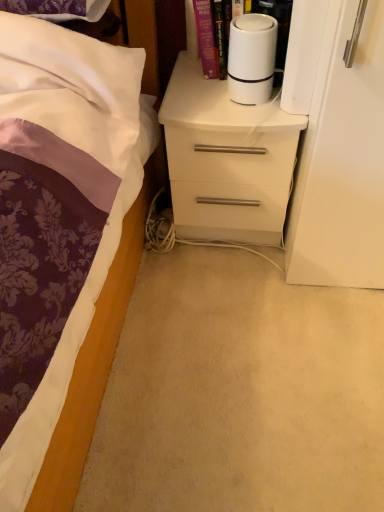
This screenshot has width=384, height=512. Identify the location of white glossy chest of drawers at center. (226, 159).

Describe the element at coordinates (251, 58) in the screenshot. I see `white matte cylindrical object at upper center` at that location.

Find the location of a particular element. white glossy chest of drawers at center is located at coordinates (226, 159).

Is white matte cylindrical object at upper center inside or outside of white matte cylindrical device at upper right?

white matte cylindrical object at upper center is spatially situated outside white matte cylindrical device at upper right.

Considering the relative sizes of white matte cylindrical object at upper center and white matte cylindrical device at upper right in the image provided, is white matte cylindrical object at upper center smaller than white matte cylindrical device at upper right?

Yes, white matte cylindrical object at upper center is smaller than white matte cylindrical device at upper right.

Considering the sizes of objects white matte cylindrical object at upper center and white matte cylindrical device at upper right in the image provided, who is taller, white matte cylindrical object at upper center or white matte cylindrical device at upper right?

With more height is white matte cylindrical device at upper right.

In the scene shown: From the image's perspective, is white matte cylindrical object at upper center over white matte cylindrical device at upper right?

No, from the image's perspective, white matte cylindrical object at upper center is not above white matte cylindrical device at upper right.

Find the location of `the chest of drawers behind the white matte cylindrical object at upper center`. the chest of drawers behind the white matte cylindrical object at upper center is located at coordinates (226, 159).

Is white matte cylindrical object at upper center at the left side of white glossy chest of drawers at center?

Incorrect, white matte cylindrical object at upper center is not on the left side of white glossy chest of drawers at center.

Is white matte cylindrical object at upper center facing away from white glossy chest of drawers at center?

white matte cylindrical object at upper center is not turned away from white glossy chest of drawers at center.

Can you confirm if white matte cylindrical object at upper center is wider than white glossy chest of drawers at center?

In fact, white matte cylindrical object at upper center might be narrower than white glossy chest of drawers at center.

In the image, is white matte cylindrical device at upper right positioned in front of or behind white glossy chest of drawers at center?

Visually, white matte cylindrical device at upper right is located in front of white glossy chest of drawers at center.

From a real-world perspective, which is physically below, white matte cylindrical device at upper right or white glossy chest of drawers at center?

white glossy chest of drawers at center.

Does white matte cylindrical device at upper right touch white glossy chest of drawers at center?

white matte cylindrical device at upper right is not next to white glossy chest of drawers at center, and they're not touching.

Is white matte cylindrical device at upper right inside the boundaries of white glossy chest of drawers at center, or outside?

white matte cylindrical device at upper right lies outside white glossy chest of drawers at center.

Who is more distant, white matte cylindrical device at upper right or white matte cylindrical object at upper center?

white matte cylindrical device at upper right is further away from the camera.

Who is smaller, white matte cylindrical device at upper right or white matte cylindrical object at upper center?

Smaller between the two is white matte cylindrical object at upper center.

Does white matte cylindrical device at upper right have a lesser width compared to white matte cylindrical object at upper center?

Incorrect, the width of white matte cylindrical device at upper right is not less than that of white matte cylindrical object at upper center.

Measure the distance between white matte cylindrical device at upper right and white matte cylindrical object at upper center.

white matte cylindrical device at upper right and white matte cylindrical object at upper center are 4.14 inches apart from each other.

Looking at this image, could white matte cylindrical device at upper right be considered to be inside white glossy chest of drawers at center?

No, white matte cylindrical device at upper right is not a part of white glossy chest of drawers at center.

Is white glossy chest of drawers at center positioned far away from white matte cylindrical device at upper right?

Actually, white glossy chest of drawers at center and white matte cylindrical device at upper right are a little close together.

Which of these two, white glossy chest of drawers at center or white matte cylindrical device at upper right, is smaller?

With smaller size is white matte cylindrical device at upper right.

Identify the location of the chest of drawers lying behind the white matte cylindrical device at upper right. (226, 159).

Which of these two, white glossy chest of drawers at center or white matte cylindrical object at upper center, is wider?

Wider between the two is white glossy chest of drawers at center.

Considering the positions of objects white glossy chest of drawers at center and white matte cylindrical object at upper center in the image provided, who is behind, white glossy chest of drawers at center or white matte cylindrical object at upper center?

white glossy chest of drawers at center is further away from the camera.

Which is less distant, (279, 163) or (272, 38)?

Clearly, point (279, 163) is more distant from the camera than point (272, 38).

Looking at this image, from a real-world perspective, which object rests below the other?

white glossy chest of drawers at center.

Where is `book on the left of the white matte cylindrical object at upper center`? The height and width of the screenshot is (512, 384). book on the left of the white matte cylindrical object at upper center is located at coordinates (194, 33).

Where is `paper towel located in front of the white glossy chest of drawers at center`? paper towel located in front of the white glossy chest of drawers at center is located at coordinates (251, 58).

Which object lies nearer to the anchor point white glossy chest of drawers at center, white matte cylindrical object at upper center or white matte cylindrical device at upper right?

white matte cylindrical object at upper center is positioned closer to the anchor white glossy chest of drawers at center.

Considering their positions, is white matte cylindrical device at upper right positioned closer to white glossy chest of drawers at center than white matte cylindrical object at upper center?

Among the two, white matte cylindrical object at upper center is located nearer to white glossy chest of drawers at center.

Considering their positions, is white matte cylindrical device at upper right positioned closer to white matte cylindrical object at upper center than white glossy chest of drawers at center?

Among the two, white matte cylindrical device at upper right is located nearer to white matte cylindrical object at upper center.

When comparing their distances from white matte cylindrical object at upper center, does white glossy chest of drawers at center or white matte cylindrical device at upper right seem further?

white glossy chest of drawers at center lies further to white matte cylindrical object at upper center than the other object.

Looking at the image, which one is located closer to white matte cylindrical device at upper right, white matte cylindrical object at upper center or white glossy chest of drawers at center?

white matte cylindrical object at upper center lies closer to white matte cylindrical device at upper right than the other object.

Estimate the real-world distances between objects in this image. Which object is further from white matte cylindrical device at upper right, white glossy chest of drawers at center or white matte cylindrical object at upper center?

Based on the image, white glossy chest of drawers at center appears to be further to white matte cylindrical device at upper right.

You are a GUI agent. You are given a task and a screenshot of the screen. Output one action in this format:
    pyautogui.click(x=<x>, y=<y>)
    Task: Click on the paper towel between white matte cylindrical device at upper right and white glossy chest of drawers at center vertically
    The image size is (384, 512).
    Given the screenshot: What is the action you would take?
    pyautogui.click(x=251, y=58)